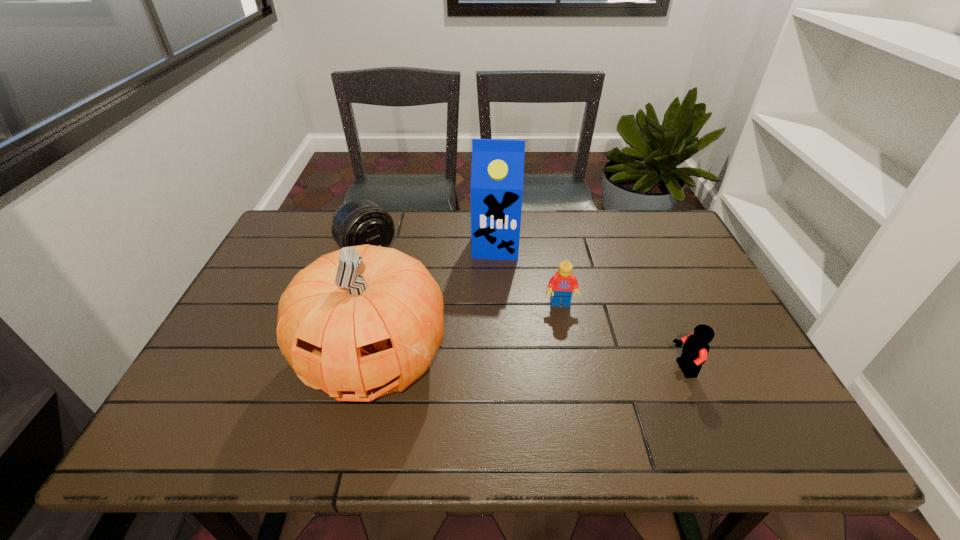
The width and height of the screenshot is (960, 540). I want to click on pumpkin, so click(362, 322).

Where is `the nearer Lego`? the nearer Lego is located at coordinates (695, 349).

Locate an element on the screen. The image size is (960, 540). the right Lego is located at coordinates (695, 349).

Image resolution: width=960 pixels, height=540 pixels. Identify the location of the third object from left to right. (497, 172).

Where is `the farther Lego`? The width and height of the screenshot is (960, 540). the farther Lego is located at coordinates (561, 285).

This screenshot has height=540, width=960. What are the coordinates of `the left Lego` in the screenshot? It's located at click(x=561, y=285).

Locate an element on the screen. the third shortest object is located at coordinates (359, 222).

The image size is (960, 540). Identify the location of free space located on the front-facing side of the right Lego. (612, 369).

I want to click on free space located 0.050m on the front-facing side of the right Lego, so [x=650, y=369].

The image size is (960, 540). Find the location of `free space located 0.130m on the front-facing side of the right Lego`. free space located 0.130m on the front-facing side of the right Lego is located at coordinates (615, 369).